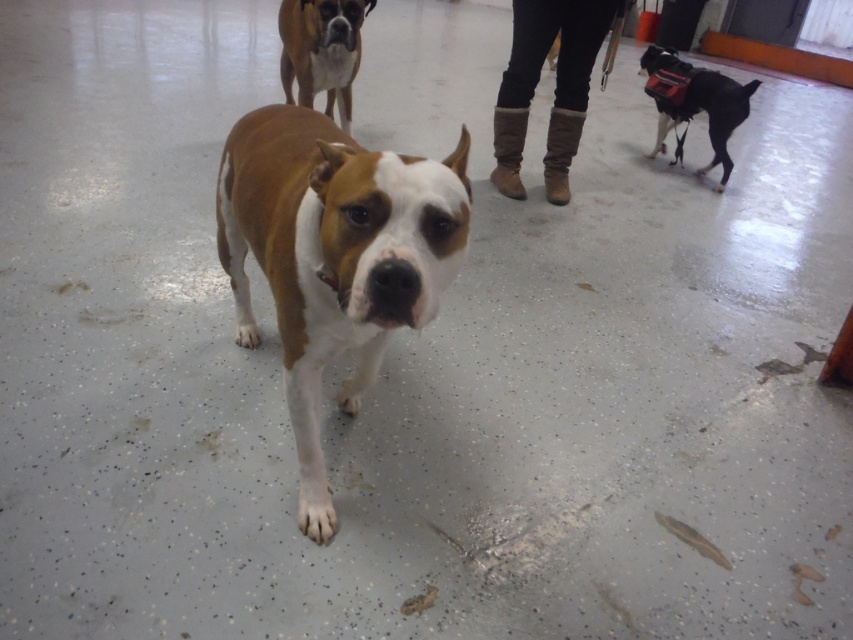
Question: Which point appears farthest from the camera in this image?

Choices:
 (A) (323, 29)
 (B) (721, 132)

Answer: (B)

Question: Is brown/white fur dog at center positioned behind brown matte dog at upper center?

Choices:
 (A) no
 (B) yes

Answer: (A)

Question: Does brown/white fur dog at center come in front of black leather dog at right?

Choices:
 (A) no
 (B) yes

Answer: (B)

Question: Where is brown matte dog at upper center located in relation to black leather dog at right in the image?

Choices:
 (A) left
 (B) right

Answer: (A)

Question: Which object appears closest to the camera in this image?

Choices:
 (A) brown/white fur dog at center
 (B) brown matte dog at upper center

Answer: (A)

Question: Estimate the real-world distances between objects in this image. Which object is farther from the black leather dog at right?

Choices:
 (A) brown matte dog at upper center
 (B) brown/white fur dog at center

Answer: (B)